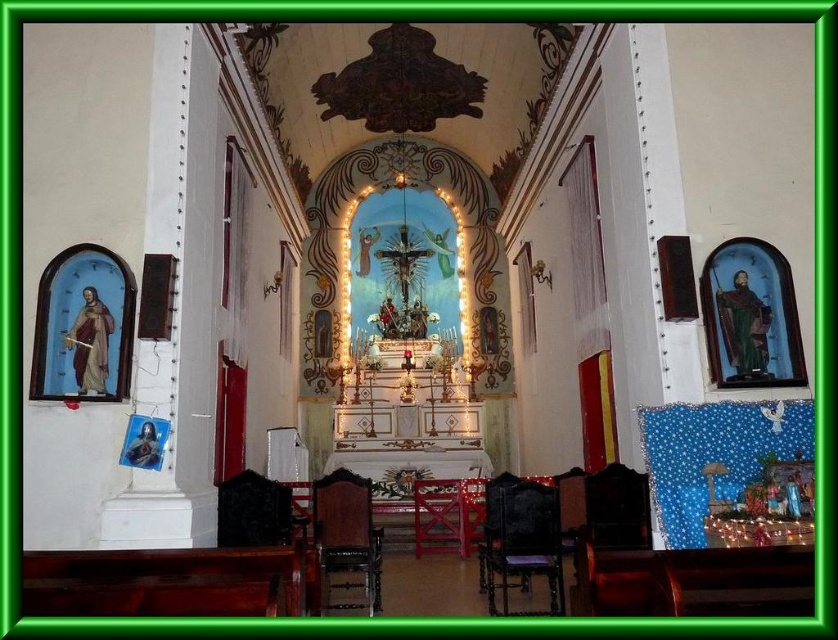
Question: Which point is farther from the camera taking this photo?

Choices:
 (A) (290, 513)
 (B) (328, 602)
 (C) (215, 588)

Answer: (A)

Question: Observing the image, what is the correct spatial positioning of wooden polished chair at center in reference to black leather chair at lower center?

Choices:
 (A) above
 (B) below

Answer: (A)

Question: Estimate the real-world distances between objects in this image. Which object is closer to the dark brown polished wood church bench at lower left?

Choices:
 (A) dark wood chair at lower right
 (B) wooden polished chair at center

Answer: (B)

Question: Which of the following is the farthest from the observer?

Choices:
 (A) (251, 532)
 (B) (547, 513)

Answer: (A)

Question: Does dark brown polished wood church bench at lower left have a lesser width compared to dark wood chair at lower right?

Choices:
 (A) no
 (B) yes

Answer: (A)

Question: Can you confirm if dark wood chair at lower right is wider than wooden polished chair at center?

Choices:
 (A) yes
 (B) no

Answer: (B)